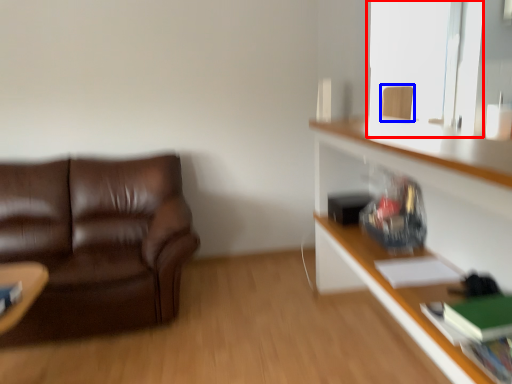
Question: Which point is further to the camera, window screen (highlighted by a red box) or swivel chair (highlighted by a blue box)?

Choices:
 (A) window screen
 (B) swivel chair

Answer: (A)